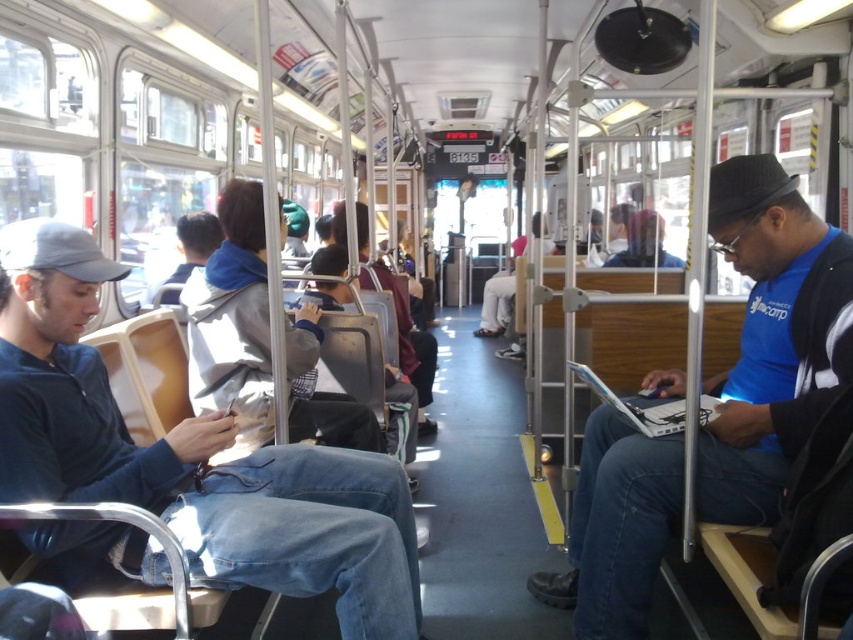
Question: Is denim jeans at left thinner than white plastic laptop at right?

Choices:
 (A) yes
 (B) no

Answer: (B)

Question: Which point is farther to the camera?

Choices:
 (A) denim jeans at left
 (B) white plastic laptop at right
 (C) blue fabric shirt at center

Answer: (B)

Question: Which point is closer to the camera?

Choices:
 (A) (68, 499)
 (B) (663, 406)

Answer: (A)

Question: Does blue fabric shirt at center have a larger size compared to white plastic laptop at right?

Choices:
 (A) no
 (B) yes

Answer: (B)

Question: Is denim jeans at left further to the viewer compared to white plastic laptop at right?

Choices:
 (A) no
 (B) yes

Answer: (A)

Question: Among these objects, which one is nearest to the camera?

Choices:
 (A) white plastic laptop at right
 (B) denim jeans at left
 (C) blue fabric shirt at center

Answer: (B)